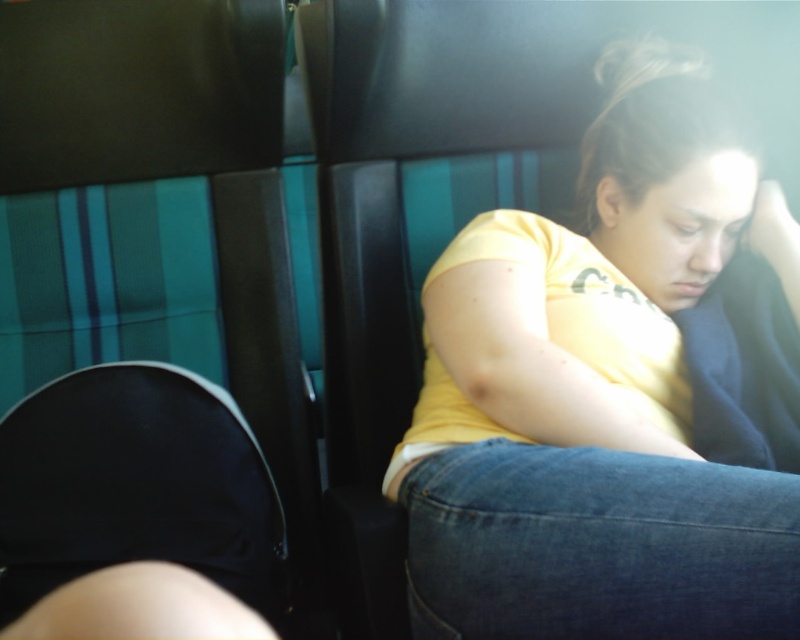
You are standing in the public transportation setting and want to place a small bag on the seat between you and the two people. The seat is 1.2 meters wide. Can you determine if there is enough space between the point at (488, 272) and the edge of the seat to place the bag?

The point at (488, 272) is 1.06 meters from the viewer, so there is 0.14 meters remaining space. Since the bag requires 0.2 meters of space, it might be too tight but possible depending on the bag size.

You are a photographer trying to capture a candid shot of the yellow cotton shirt at center and the black leather chair at upper left. Since you want to ensure both subjects are in focus, you need to know their relative heights. Which object is taller?

The yellow cotton shirt at center is shorter than the black leather chair at upper left, so you should adjust your camera settings to account for their height difference to ensure both are in focus.